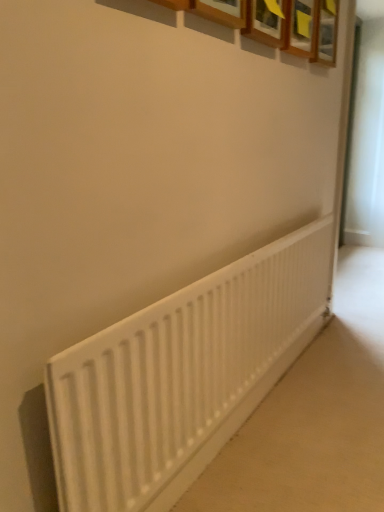
Question: Does wooden frame at upper center, which is counted as the second picture frame, starting from the back, have a smaller size compared to wooden picture frame at upper center, which is the first picture frame from right to left?

Choices:
 (A) yes
 (B) no

Answer: (A)

Question: From a real-world perspective, is wooden frame at upper center, positioned as the 1th picture frame in front-to-back order, on top of wooden picture frame at upper center, the 2th picture frame when ordered from left to right?

Choices:
 (A) no
 (B) yes

Answer: (A)

Question: Can you confirm if wooden frame at upper center, the 1th picture frame in the left-to-right sequence, is bigger than wooden picture frame at upper center, the second picture frame in the front-to-back sequence?

Choices:
 (A) yes
 (B) no

Answer: (B)

Question: Is wooden frame at upper center, which is counted as the second picture frame, starting from the back, positioned far away from wooden picture frame at upper center, which ranks as the first picture frame in back-to-front order?

Choices:
 (A) no
 (B) yes

Answer: (A)

Question: Is wooden frame at upper center, which is counted as the second picture frame, starting from the back, wider than wooden picture frame at upper center, which ranks as the first picture frame in back-to-front order?

Choices:
 (A) no
 (B) yes

Answer: (B)

Question: Choose the correct answer: Is wooden frame at upper center, the 1th picture frame in the left-to-right sequence, inside wooden picture frame at upper center, the 2th picture frame when ordered from left to right, or outside it?

Choices:
 (A) inside
 (B) outside

Answer: (B)

Question: Considering their positions, is wooden frame at upper center, the 1th picture frame in the left-to-right sequence, located in front of or behind wooden picture frame at upper center, the 2th picture frame when ordered from left to right?

Choices:
 (A) front
 (B) behind

Answer: (A)

Question: From the image's perspective, relative to wooden picture frame at upper center, which is the first picture frame from right to left, is wooden frame at upper center, which is the second picture frame in right-to-left order, above or below?

Choices:
 (A) below
 (B) above

Answer: (A)

Question: From their relative heights in the image, would you say wooden frame at upper center, which is the second picture frame in right-to-left order, is taller or shorter than wooden picture frame at upper center, the 2th picture frame when ordered from left to right?

Choices:
 (A) short
 (B) tall

Answer: (A)

Question: Relative to wooden frame at upper center, which is counted as the second picture frame, starting from the back, is wooden picture frame at upper center, which ranks as the first picture frame in back-to-front order, in front or behind?

Choices:
 (A) behind
 (B) front

Answer: (A)

Question: Is point (334, 62) closer or farther from the camera than point (309, 31)?

Choices:
 (A) closer
 (B) farther

Answer: (B)

Question: Based on their sizes in the image, would you say wooden picture frame at upper center, which is the first picture frame from right to left, is bigger or smaller than wooden frame at upper center, the 1th picture frame in the left-to-right sequence?

Choices:
 (A) big
 (B) small

Answer: (A)

Question: Considering the relative positions of wooden picture frame at upper center, which ranks as the first picture frame in back-to-front order, and wooden frame at upper center, the 1th picture frame in the left-to-right sequence, in the image provided, is wooden picture frame at upper center, which ranks as the first picture frame in back-to-front order, to the left or to the right of wooden frame at upper center, the 1th picture frame in the left-to-right sequence,?

Choices:
 (A) right
 (B) left

Answer: (A)

Question: Considering the positions of white matte radiator at lower center and wooden frame at upper center, which is counted as the second picture frame, starting from the back, in the image, is white matte radiator at lower center wider or thinner than wooden frame at upper center, which is counted as the second picture frame, starting from the back,?

Choices:
 (A) wide
 (B) thin

Answer: (B)

Question: From their relative heights in the image, would you say white matte radiator at lower center is taller or shorter than wooden frame at upper center, positioned as the 1th picture frame in front-to-back order?

Choices:
 (A) short
 (B) tall

Answer: (B)